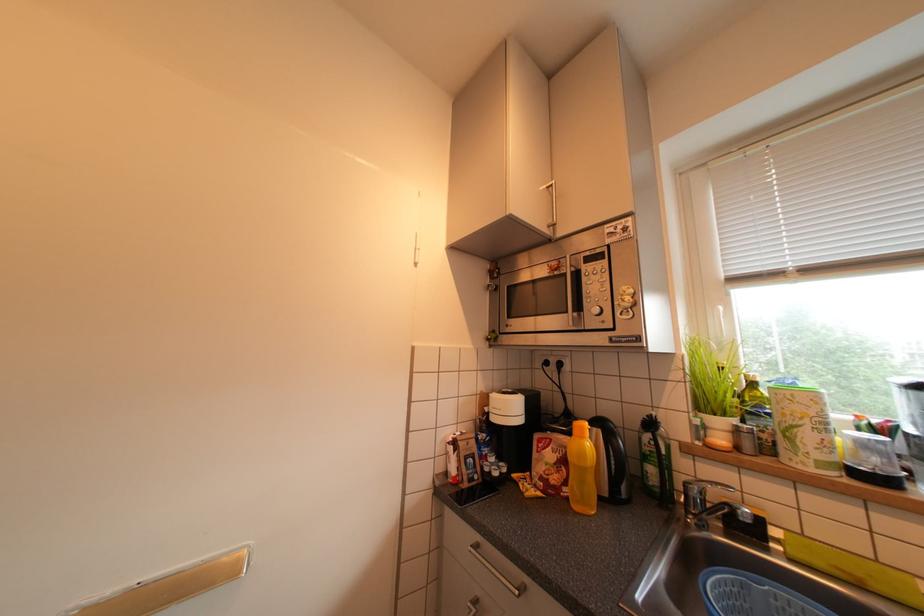
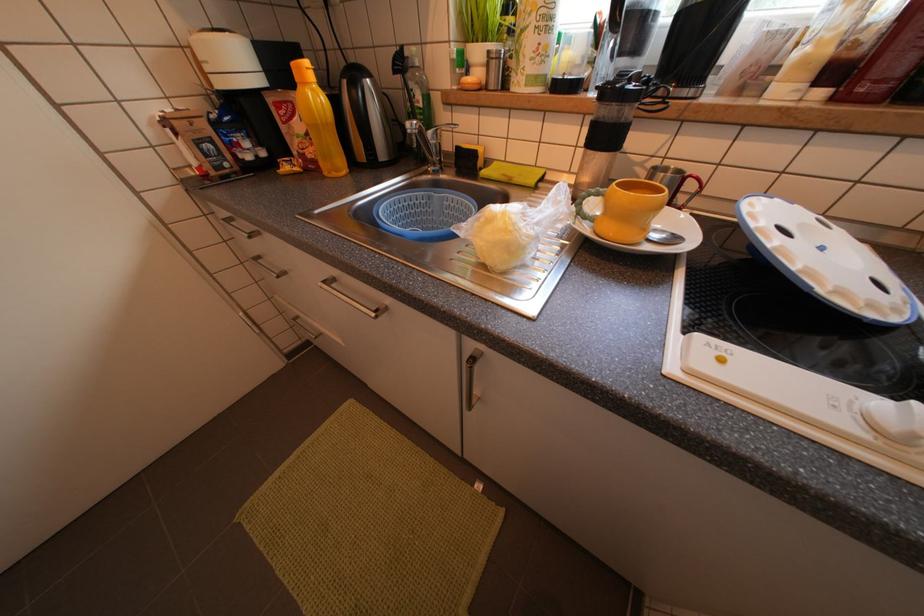
Based on the continuous images, in which direction is the camera rotating?

The camera's rotation is toward right-down.